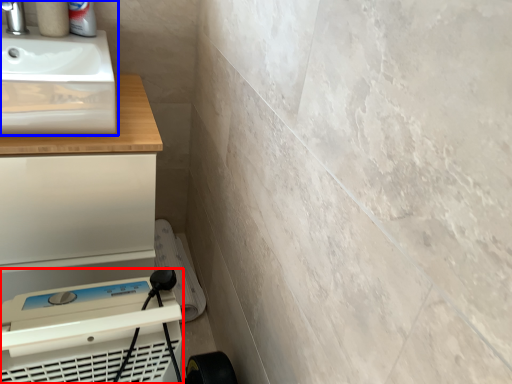
Question: Which object is closer to the camera taking this photo, appliance (highlighted by a red box) or sink (highlighted by a blue box)?

Choices:
 (A) appliance
 (B) sink

Answer: (A)